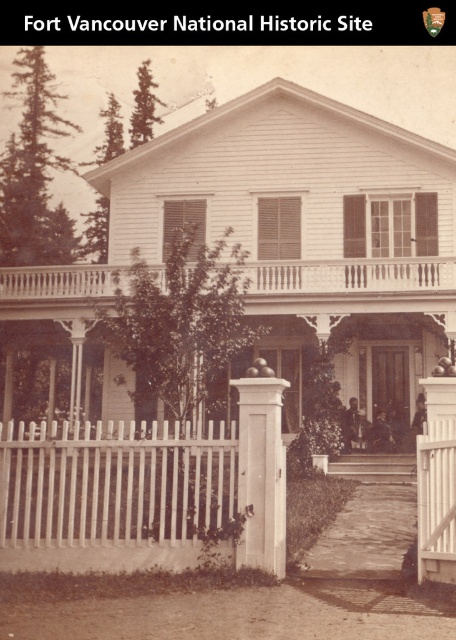
Question: Which of the following is the closest to the observer?

Choices:
 (A) (442, 285)
 (B) (273, 563)

Answer: (B)

Question: In this image, where is white wooden porch at center located relative to white smooth post at center?

Choices:
 (A) left
 (B) right

Answer: (A)

Question: Which of the following is the farthest from the observer?

Choices:
 (A) (430, 291)
 (B) (279, 404)

Answer: (A)

Question: Which object appears farthest from the camera in this image?

Choices:
 (A) white smooth post at center
 (B) white wooden porch at center

Answer: (B)

Question: Can you confirm if white wooden porch at center is smaller than white smooth post at center?

Choices:
 (A) yes
 (B) no

Answer: (A)

Question: Is white wooden porch at center closer to the viewer compared to white smooth post at center?

Choices:
 (A) yes
 (B) no

Answer: (B)